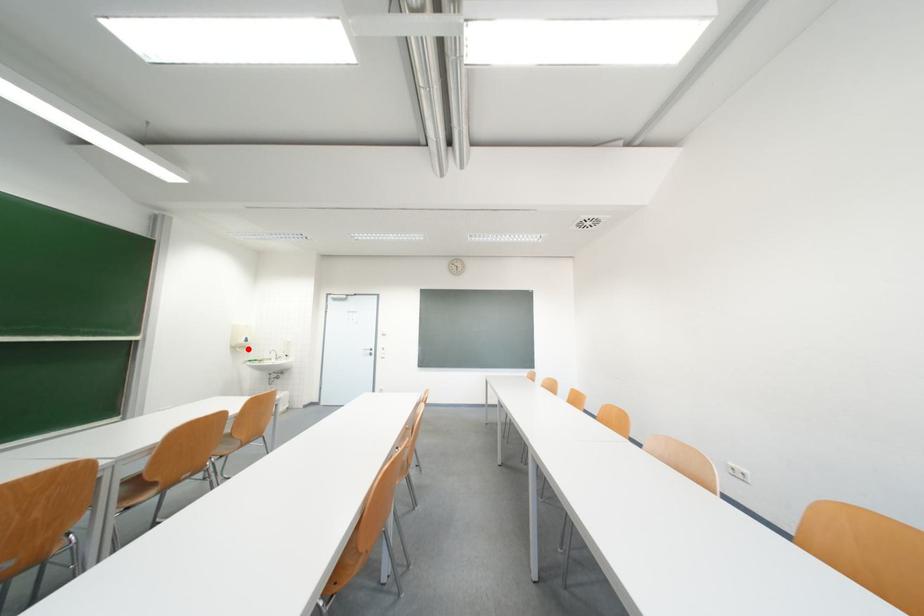
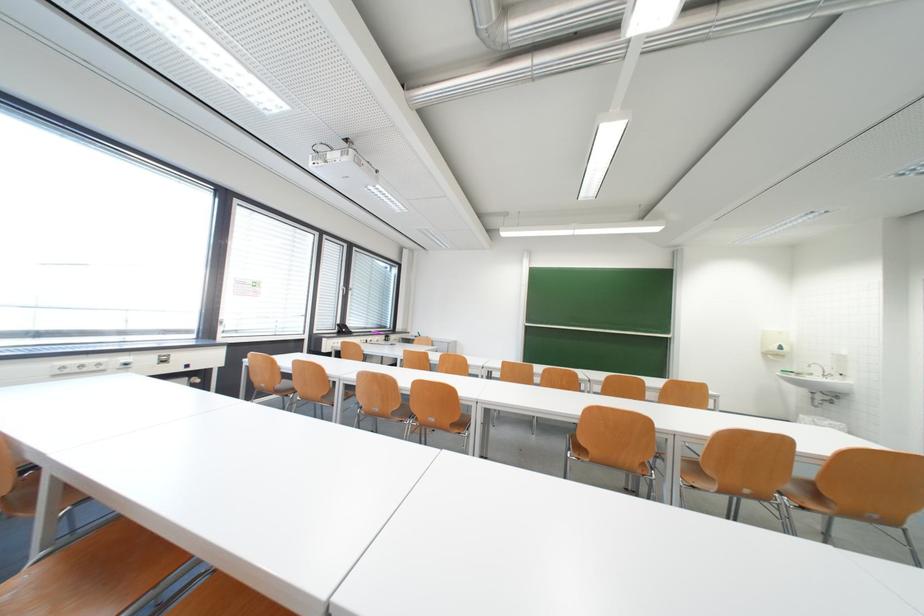
The point at the highlighted location is marked in the first image. Where is the corresponding point in the second image?

(784, 357)